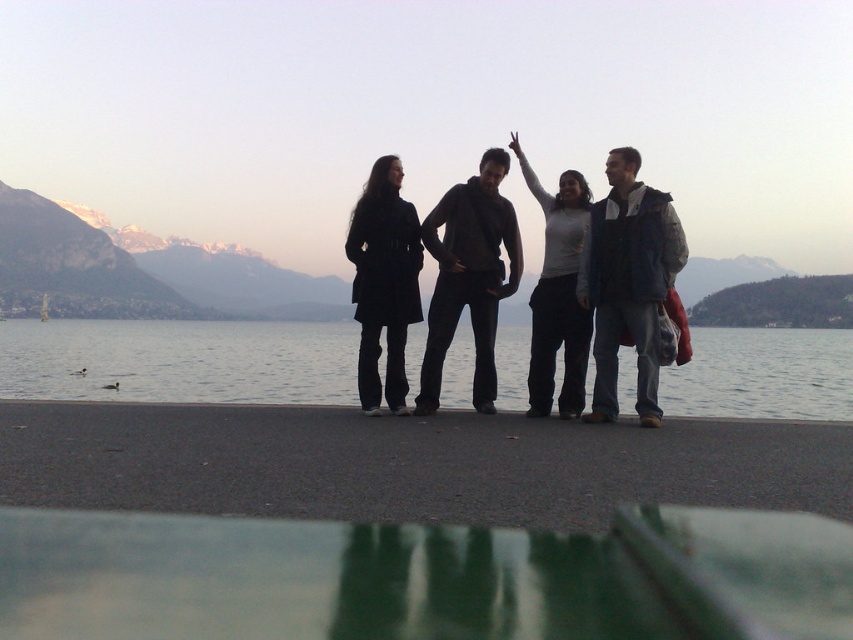
Question: Can you confirm if transparent water at lower center is thinner than white matte shirt at center?

Choices:
 (A) yes
 (B) no

Answer: (B)

Question: Among these points, which one is nearest to the camera?

Choices:
 (A) (567, 301)
 (B) (434, 353)
 (C) (602, 304)
 (D) (372, 196)

Answer: (C)

Question: Does dark blue jacket at right have a smaller size compared to black matte coat at left?

Choices:
 (A) yes
 (B) no

Answer: (B)

Question: Which of the following is the farthest from the observer?

Choices:
 (A) (393, 397)
 (B) (547, 246)

Answer: (B)

Question: Can you confirm if black matte coat at left is bigger than white matte shirt at center?

Choices:
 (A) yes
 (B) no

Answer: (B)

Question: Which of the following is the closest to the observer?

Choices:
 (A) dark blue jacket at right
 (B) dark gray hoodie at center
 (C) white matte shirt at center

Answer: (A)